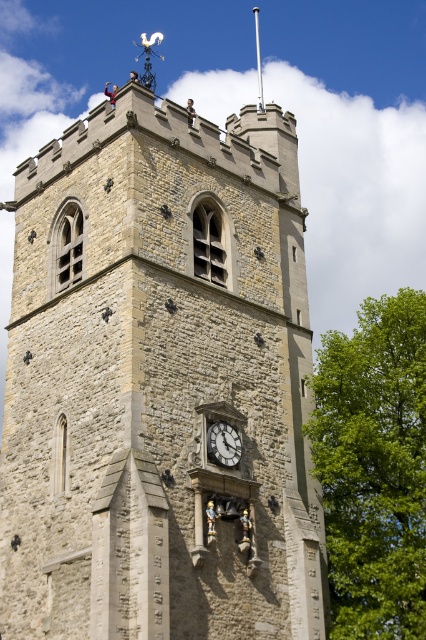
You are standing at the base of the stone clock tower at center and want to see the top of the green leafy tree at right. Can you see the entire tree from your current position?

The stone clock tower at center is taller than the green leafy tree at right, so yes, you can see the entire tree from your current position at the base of the tower.

You are an architect examining the stone clock tower at center and the white stone clock at center. Which object is located more to the right side?

The white stone clock at center is more to the right side because the stone clock tower at center is positioned on the left side of it.

You are standing in front of the stone clock tower at center. If you want to throw a ball to reach the top of the tower, which is 30 meters high, can you do it from your current position? Please explain why.

The stone clock tower at center is 32.67 meters away from the viewer. The tower is 30 meters high. Since the distance to the tower is greater than its height, throwing a ball to reach the top would require both sufficient horizontal distance and vertical reach, which is unlikely under normal circumstances.